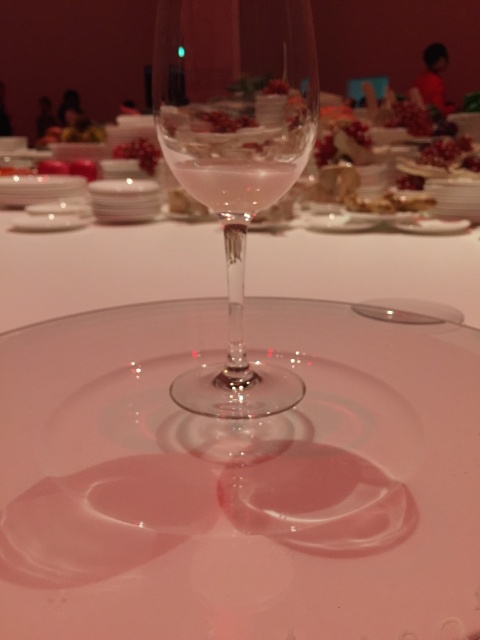
In the scene shown: Who is more forward, (x=231, y=218) or (x=208, y=116)?

Point (x=208, y=116)

Describe the element at coordinates (236, 154) in the screenshot. I see `clear glass wine glass at center` at that location.

Describe the element at coordinates (236, 154) in the screenshot. The height and width of the screenshot is (640, 480). I see `clear glass wine glass at center` at that location.

Find the location of a particular element. clear glass wine glass at center is located at coordinates (236, 154).

Between point (407, 234) and point (254, 124), which one is positioned behind?

The point (407, 234) is more distant.

Between point (273, 244) and point (247, 116), which one is positioned in front?

Point (247, 116) is in front.

Is point (453, 243) farther from viewer compared to point (222, 131)?

Yes.

You are a GUI agent. You are given a task and a screenshot of the screen. Output one action in this format:
    pyautogui.click(x=<x>, y=<y>)
    Task: Click on the transparent glass at center
    The image size is (480, 640).
    Given the screenshot: What is the action you would take?
    pyautogui.click(x=105, y=268)

Does clear glass wine glass at center appear over transparent glass at center?

Yes, clear glass wine glass at center is above transparent glass at center.

Who is more distant from viewer, (164,84) or (290,272)?

The point (290,272) is behind.

Is point (298, 65) closer to camera compared to point (107, 259)?

Yes, it is.

What are the coordinates of `clear glass wine glass at center` in the screenshot? It's located at (236, 154).